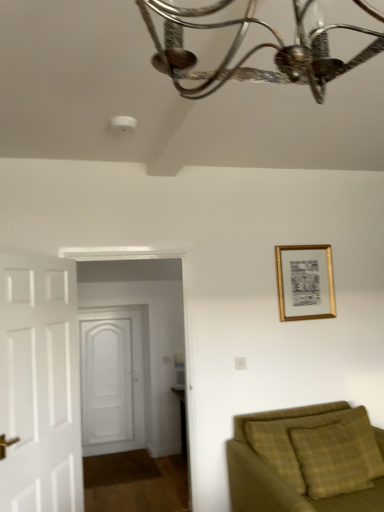
Question: In which direction should I rotate to look at white wooden door at center, which is the 2th door from front to back?

Choices:
 (A) left
 (B) right

Answer: (A)

Question: Can you confirm if white wooden door at center, which is the 2th door from front to back, is positioned to the right of green plaid fabric couch at lower right?

Choices:
 (A) yes
 (B) no

Answer: (B)

Question: Can you confirm if white wooden door at center, marked as the first door in a back-to-front arrangement, is bigger than green plaid fabric couch at lower right?

Choices:
 (A) yes
 (B) no

Answer: (B)

Question: Does white wooden door at center, marked as the first door in a back-to-front arrangement, have a smaller size compared to green plaid fabric couch at lower right?

Choices:
 (A) yes
 (B) no

Answer: (A)

Question: From a real-world perspective, does white wooden door at center, which is the 2th door from front to back, sit lower than green plaid fabric couch at lower right?

Choices:
 (A) no
 (B) yes

Answer: (A)

Question: Is white wooden door at center, marked as the first door in a back-to-front arrangement, positioned with its back to green plaid fabric couch at lower right?

Choices:
 (A) no
 (B) yes

Answer: (A)

Question: Is white wooden door at center, which is the 2th door from front to back, positioned before green plaid fabric couch at lower right?

Choices:
 (A) yes
 (B) no

Answer: (B)

Question: Is green plaid fabric couch at lower right bigger than white wooden door at center, which is the 2th door from front to back?

Choices:
 (A) yes
 (B) no

Answer: (A)

Question: From the image's perspective, is green plaid fabric couch at lower right on white wooden door at center, marked as the first door in a back-to-front arrangement?

Choices:
 (A) yes
 (B) no

Answer: (A)

Question: Can you confirm if green plaid fabric couch at lower right is thinner than white wooden door at center, which is the 2th door from front to back?

Choices:
 (A) no
 (B) yes

Answer: (A)

Question: Is green plaid fabric couch at lower right not within white wooden door at center, which is the 2th door from front to back?

Choices:
 (A) yes
 (B) no

Answer: (A)

Question: Could you tell me if green plaid fabric couch at lower right is facing white wooden door at center, which is the 2th door from front to back?

Choices:
 (A) no
 (B) yes

Answer: (A)

Question: From the image's perspective, is green plaid fabric couch at lower right located beneath white wooden door at center, which is the 2th door from front to back?

Choices:
 (A) no
 (B) yes

Answer: (A)

Question: Is gold metallic picture frame at upper right positioned with its back to white wooden door at left, which ranks as the 1th door in front-to-back order?

Choices:
 (A) no
 (B) yes

Answer: (A)